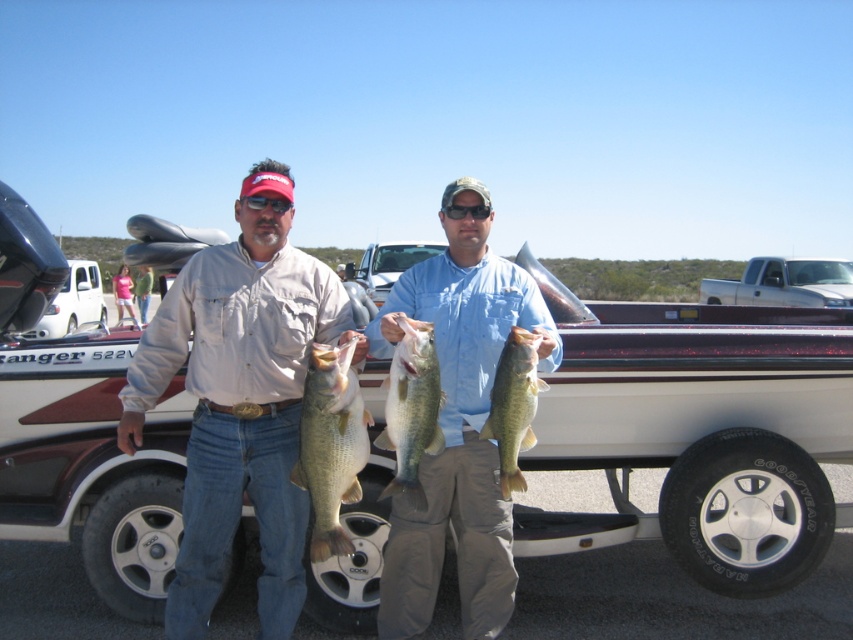
The image size is (853, 640). I want to click on white plastic boat at center, so click(701, 436).

Can you confirm if white plastic boat at center is positioned to the right of greenish-yellow flesh at center?

Yes, white plastic boat at center is to the right of greenish-yellow flesh at center.

Locate an element on the screen. The width and height of the screenshot is (853, 640). white plastic boat at center is located at coordinates (701, 436).

Can you confirm if matte khaki shirt at center is positioned to the right of greenish-yellow flesh at center?

Incorrect, matte khaki shirt at center is not on the right side of greenish-yellow flesh at center.

Is point (247, 490) positioned before point (498, 456)?

That is False.

This screenshot has width=853, height=640. I want to click on matte khaki shirt at center, so click(241, 400).

Who is positioned more to the left, white plastic boat at center or greenish-blue scales at center?

greenish-blue scales at center is more to the left.

Who is shorter, white plastic boat at center or greenish-blue scales at center?

Standing shorter between the two is white plastic boat at center.

Who is more forward, (109, 572) or (461, 582)?

Point (461, 582)

This screenshot has width=853, height=640. I want to click on white plastic boat at center, so click(701, 436).